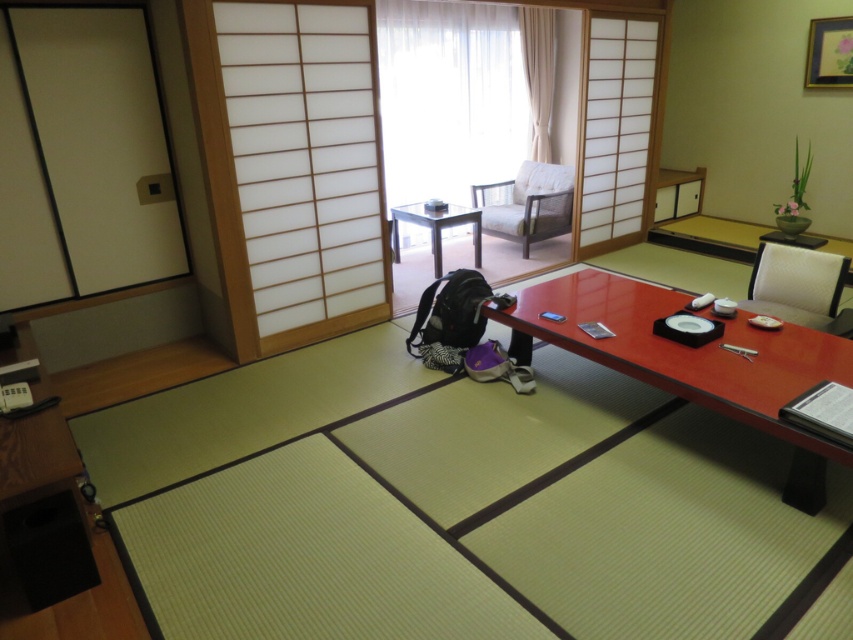
Is point (775, 257) in front of point (479, 186)?

Yes, point (775, 257) is in front of point (479, 186).

Which of these two, white fabric chair at right or light brown wood chair at upper center, stands taller?

light brown wood chair at upper center is taller.

Locate an element on the screen. white fabric chair at right is located at coordinates (796, 284).

Identify the location of white fabric chair at right. (796, 284).

In the scene shown: Can you confirm if white fabric chair at right is smaller than beige fabric curtain at upper center?

Yes.

Who is lower down, white fabric chair at right or beige fabric curtain at upper center?

Positioned lower is white fabric chair at right.

At what (x,y) coordinates should I click in order to perform the action: click on white fabric chair at right. Please return your answer as a coordinate pair (x, y). Looking at the image, I should click on (796, 284).

Where is `white fabric chair at right`? white fabric chair at right is located at coordinates (796, 284).

Does point (555, 326) come farther from viewer compared to point (434, 212)?

No, (555, 326) is closer to viewer.

What do you see at coordinates (692, 360) in the screenshot? The height and width of the screenshot is (640, 853). I see `smooth red wooden table at center` at bounding box center [692, 360].

The height and width of the screenshot is (640, 853). I want to click on smooth red wooden table at center, so click(x=692, y=360).